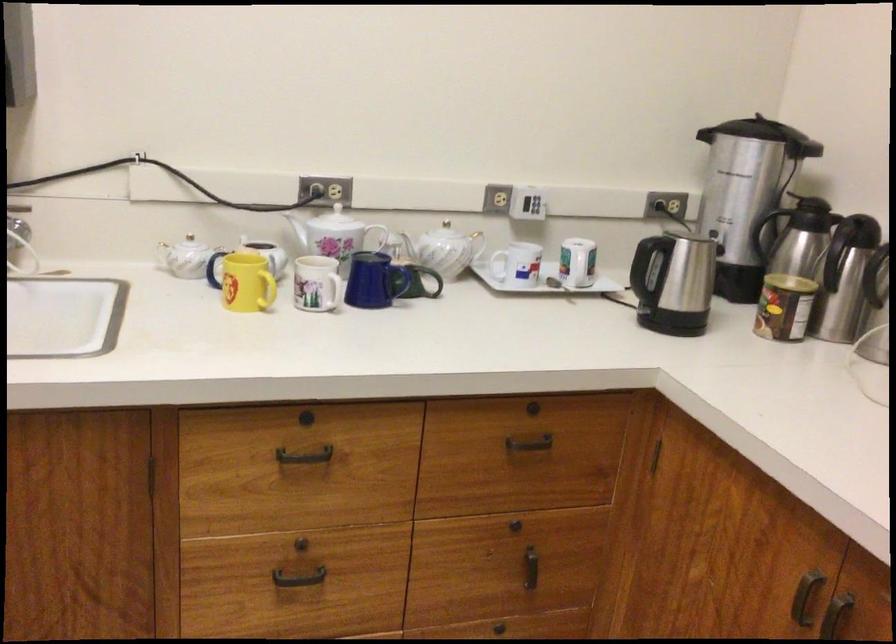
Where is `faucet handle`? The width and height of the screenshot is (896, 644). faucet handle is located at coordinates (16, 211).